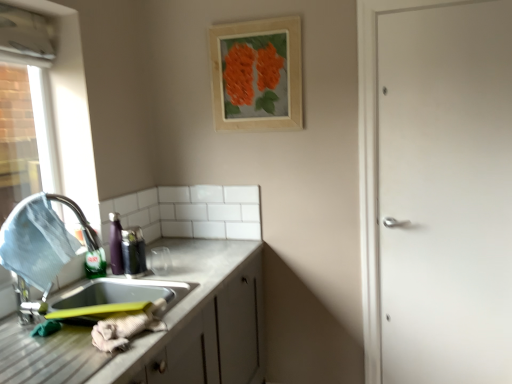
Where is `metallic stainless steel sink at left`? The width and height of the screenshot is (512, 384). metallic stainless steel sink at left is located at coordinates (126, 297).

What's the angular difference between metallic stainless steel sink at left and wooden frame at upper center's facing directions?

The angular difference between metallic stainless steel sink at left and wooden frame at upper center is 135 degrees.

Is point (148, 266) behind point (272, 38)?

That is False.

Considering the sizes of objects metallic stainless steel sink at left and wooden frame at upper center in the image provided, who is wider, metallic stainless steel sink at left or wooden frame at upper center?

With larger width is metallic stainless steel sink at left.

Is the position of metallic stainless steel sink at left less distant than that of metallic stainless steel sink at lower left?

No, metallic stainless steel sink at left is further to the viewer.

Do you think metallic stainless steel sink at left is within metallic stainless steel sink at lower left, or outside of it?

The correct answer is: outside.

I want to click on sink behind the metallic stainless steel sink at lower left, so click(x=126, y=297).

How different are the orientations of metallic stainless steel sink at left and metallic stainless steel sink at lower left in degrees?

The angle between the facing direction of metallic stainless steel sink at left and the facing direction of metallic stainless steel sink at lower left is 45.9 degrees.

Is metallic stainless steel sink at lower left looking in the opposite direction of wooden frame at upper center?

metallic stainless steel sink at lower left does not have its back to wooden frame at upper center.

Is metallic stainless steel sink at lower left inside or outside of wooden frame at upper center?

metallic stainless steel sink at lower left is not inside wooden frame at upper center, it's outside.

How many degrees apart are the facing directions of metallic stainless steel sink at lower left and wooden frame at upper center?

The angular difference between metallic stainless steel sink at lower left and wooden frame at upper center is 88.8 degrees.

From the picture: Which of these two, metallic stainless steel sink at lower left or wooden frame at upper center, is wider?

Wider between the two is metallic stainless steel sink at lower left.

Considering the sizes of white matte door at right and metallic stainless steel sink at left in the image, is white matte door at right taller or shorter than metallic stainless steel sink at left?

Considering their sizes, white matte door at right has more height than metallic stainless steel sink at left.

Which of these two, white matte door at right or metallic stainless steel sink at left, is bigger?

white matte door at right.

Is white matte door at right aimed at metallic stainless steel sink at left?

No, white matte door at right is not oriented towards metallic stainless steel sink at left.

Is white matte door at right facing away from metallic stainless steel sink at lower left?

No, white matte door at right's orientation is not away from metallic stainless steel sink at lower left.

Can you tell me how much white matte door at right and metallic stainless steel sink at lower left differ in facing direction?

88.4 degrees.

Based on their positions, is white matte door at right located to the left or right of metallic stainless steel sink at lower left?

white matte door at right is positioned on metallic stainless steel sink at lower left's right side.

Based on the photo, is white matte door at right further to camera compared to metallic stainless steel sink at lower left?

Yes, it is behind metallic stainless steel sink at lower left.

Is wooden frame at upper center inside or outside of metallic stainless steel sink at left?

wooden frame at upper center is located beyond the bounds of metallic stainless steel sink at left.

Which object is thinner, wooden frame at upper center or metallic stainless steel sink at left?

wooden frame at upper center is thinner.

Considering the relative sizes of wooden frame at upper center and metallic stainless steel sink at left in the image provided, is wooden frame at upper center taller than metallic stainless steel sink at left?

Yes, wooden frame at upper center is taller than metallic stainless steel sink at left.

From the image's perspective, which is below, wooden frame at upper center or metallic stainless steel sink at left?

metallic stainless steel sink at left, from the image's perspective.

Considering their positions, is wooden frame at upper center located in front of or behind white matte door at right?

wooden frame at upper center is behind white matte door at right.

Between wooden frame at upper center and white matte door at right, which one has smaller width?

Thinner between the two is wooden frame at upper center.

From the image's perspective, which is above, wooden frame at upper center or white matte door at right?

wooden frame at upper center is shown above in the image.

Which is more to the left, wooden frame at upper center or white matte door at right?

Positioned to the left is wooden frame at upper center.

Where is `sink on the left side of wooden frame at upper center`? sink on the left side of wooden frame at upper center is located at coordinates pyautogui.click(x=126, y=297).

Find the location of a particular element. The height and width of the screenshot is (384, 512). sink above the metallic stainless steel sink at lower left (from the image's perspective) is located at coordinates (126, 297).

From the image, which object appears to be farther from wooden frame at upper center, white matte door at right or metallic stainless steel sink at lower left?

The object further to wooden frame at upper center is metallic stainless steel sink at lower left.

Which object lies further to the anchor point wooden frame at upper center, metallic stainless steel sink at lower left or white matte door at right?

metallic stainless steel sink at lower left.

When comparing their distances from white matte door at right, does metallic stainless steel sink at left or metallic stainless steel sink at lower left seem closer?

metallic stainless steel sink at lower left lies closer to white matte door at right than the other object.

Based on their spatial positions, is white matte door at right or wooden frame at upper center further from metallic stainless steel sink at left?

Based on the image, white matte door at right appears to be further to metallic stainless steel sink at left.

Estimate the real-world distances between objects in this image. Which object is closer to metallic stainless steel sink at lower left, white matte door at right or wooden frame at upper center?

Based on the image, wooden frame at upper center appears to be nearer to metallic stainless steel sink at lower left.

When comparing their distances from metallic stainless steel sink at lower left, does metallic stainless steel sink at left or white matte door at right seem closer?

The object closer to metallic stainless steel sink at lower left is metallic stainless steel sink at left.

Estimate the real-world distances between objects in this image. Which object is closer to metallic stainless steel sink at left, metallic stainless steel sink at lower left or white matte door at right?

The object closer to metallic stainless steel sink at left is metallic stainless steel sink at lower left.

Estimate the real-world distances between objects in this image. Which object is further from metallic stainless steel sink at left, metallic stainless steel sink at lower left or wooden frame at upper center?

wooden frame at upper center is positioned further to the anchor metallic stainless steel sink at left.

Locate an element on the screen. This screenshot has height=384, width=512. sink between wooden frame at upper center and metallic stainless steel sink at lower left in the up-down direction is located at coordinates (126, 297).

At what (x,y) coordinates should I click in order to perform the action: click on picture frame between metallic stainless steel sink at left and white matte door at right. Please return your answer as a coordinate pair (x, y). Looking at the image, I should click on (257, 74).

This screenshot has width=512, height=384. In order to click on picture frame between metallic stainless steel sink at lower left and white matte door at right in the horizontal direction in this screenshot , I will do `click(257, 74)`.

Where is `cabinetry between metallic stainless steel sink at left and white matte door at right`? Image resolution: width=512 pixels, height=384 pixels. cabinetry between metallic stainless steel sink at left and white matte door at right is located at coordinates (160, 332).